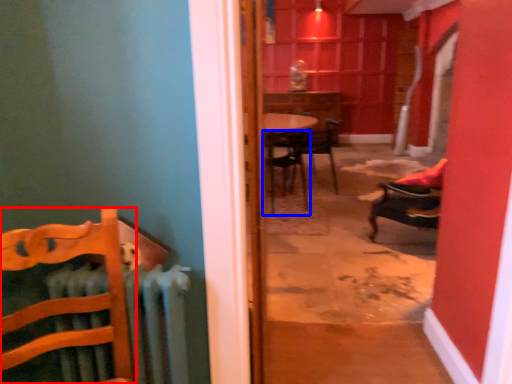
Question: Which object appears closest to the camera in this image, chair (highlighted by a red box) or chair (highlighted by a blue box)?

Choices:
 (A) chair
 (B) chair

Answer: (A)